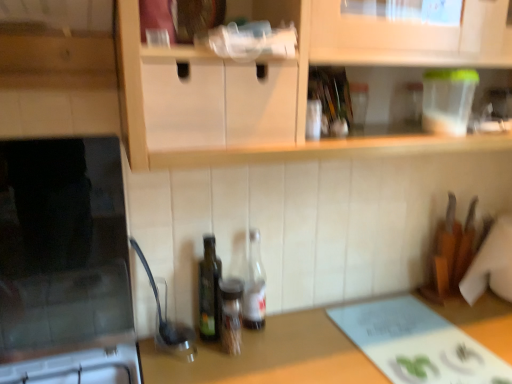
Question: Would you say translucent glass spice jar at center, which is the second bottle in left-to-right order, is inside or outside translucent glass bottle at center, which appears as the 3th bottle when viewed from the left?

Choices:
 (A) outside
 (B) inside

Answer: (A)

Question: From a real-world perspective, is translucent glass spice jar at center, which is the second bottle in left-to-right order, positioned above or below translucent glass bottle at center, the first bottle when ordered from right to left?

Choices:
 (A) below
 (B) above

Answer: (A)

Question: Based on their relative distances, which object is farther from the translucent glass bottle at center, which appears as the 3th bottle when viewed from the left?

Choices:
 (A) translucent glass spice jar at center, which is the second bottle in left-to-right order
 (B) black glass microwave at left
 (C) green glass bottle at center, which is counted as the first bottle, starting from the left
 (D) brown wooden countertop at center

Answer: (B)

Question: Based on their relative distances, which object is nearer to the brown wooden countertop at center?

Choices:
 (A) translucent glass bottle at center, which appears as the 3th bottle when viewed from the left
 (B) translucent glass spice jar at center, which is the second bottle in left-to-right order
 (C) green glass bottle at center, which is counted as the first bottle, starting from the left
 (D) black glass microwave at left

Answer: (B)